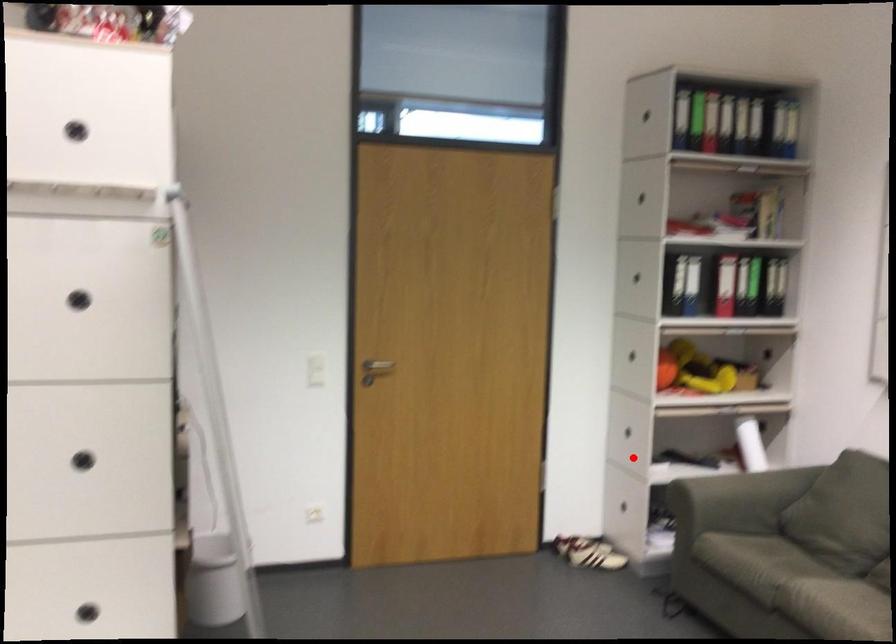
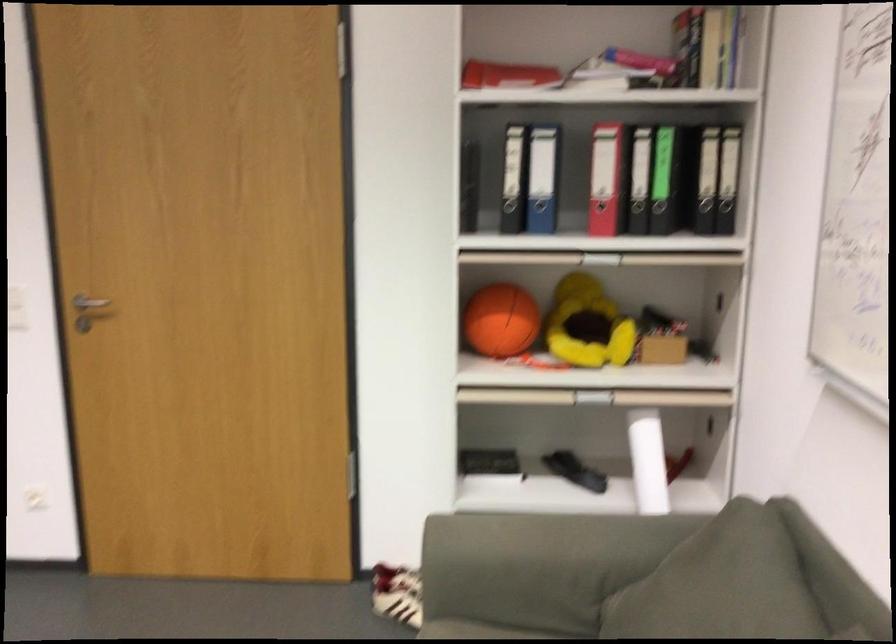
Question: I am providing you with two images of the same scene from different viewpoints. A red point is shown in image1. For the corresponding object point in image2, is it positioned nearer or farther from the camera?

Choices:
 (A) Nearer
 (B) Farther

Answer: (A)